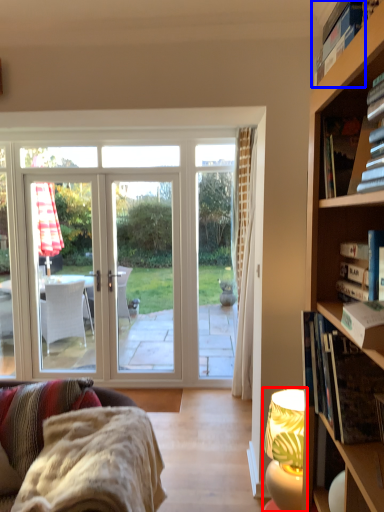
Question: Which object is further to the camera taking this photo, lamp (highlighted by a red box) or book (highlighted by a blue box)?

Choices:
 (A) lamp
 (B) book

Answer: (A)